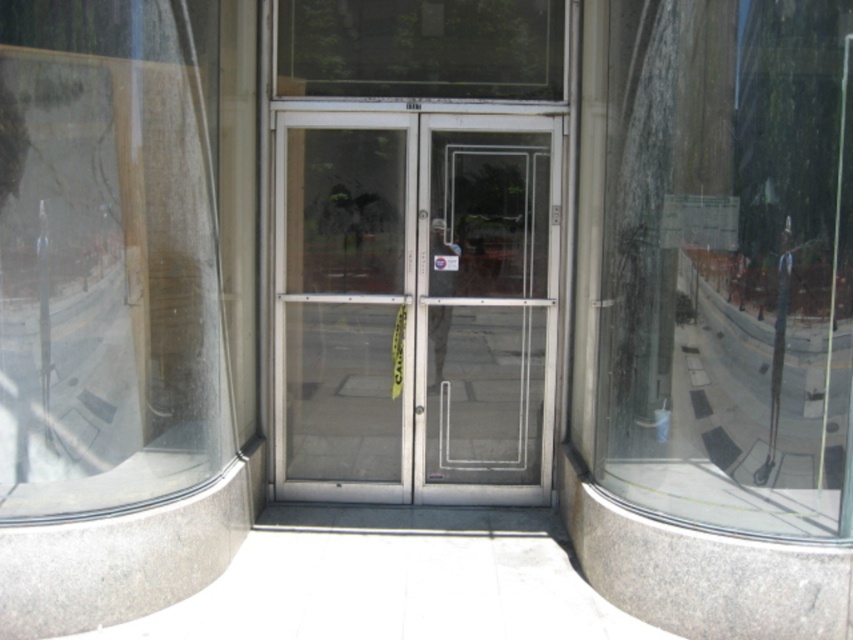
Does point (608, 26) lie behind point (317, 403)?

No, (608, 26) is in front of (317, 403).

Is transparent glass window at center taller than clear glass door at center?

Correct, transparent glass window at center is much taller as clear glass door at center.

Is point (674, 390) less distant than point (373, 192)?

Yes.

The height and width of the screenshot is (640, 853). In order to click on transparent glass window at center in this screenshot , I will do `click(727, 262)`.

Find the location of `transparent glass door at center`. transparent glass door at center is located at coordinates (415, 307).

Can you confirm if transparent glass door at center is wider than clear glass door at center?

Yes, transparent glass door at center is wider than clear glass door at center.

Find the location of a particular element. transparent glass door at center is located at coordinates (415, 307).

Does transparent glass window at center have a greater height compared to transparent glass window at left?

Correct, transparent glass window at center is much taller as transparent glass window at left.

Between point (611, 205) and point (166, 401), which one is positioned behind?

The point (611, 205) is more distant.

Locate an element on the screen. transparent glass window at center is located at coordinates (727, 262).